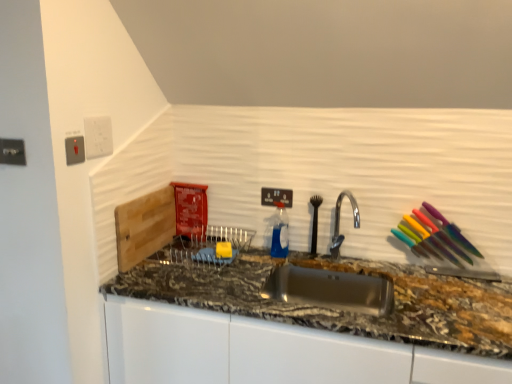
Question: Could you tell me if white plastic electric outlet at upper left, marked as the 2th electric outlet in a back-to-front arrangement, is turned towards black plastic electric outlet at upper center, positioned as the fourth electric outlet in left-to-right order?

Choices:
 (A) yes
 (B) no

Answer: (B)

Question: Is black plastic electric outlet at upper center, which appears as the fourth electric outlet when viewed from the front, inside white plastic electric outlet at upper left, the 3th electric outlet when ordered from front to back?

Choices:
 (A) no
 (B) yes

Answer: (A)

Question: From the image's perspective, is white plastic electric outlet at upper left, the 3th electric outlet when ordered from front to back, under black plastic electric outlet at upper center, arranged as the first electric outlet when viewed from the right?

Choices:
 (A) yes
 (B) no

Answer: (B)

Question: Does white plastic electric outlet at upper left, which is the 3th electric outlet in left-to-right order, have a lesser width compared to black plastic electric outlet at upper center, arranged as the first electric outlet when viewed from the right?

Choices:
 (A) yes
 (B) no

Answer: (A)

Question: Can you confirm if white plastic electric outlet at upper left, the 3th electric outlet when ordered from front to back, is positioned to the left of black plastic electric outlet at upper center, which appears as the first electric outlet when viewed from the back?

Choices:
 (A) yes
 (B) no

Answer: (A)

Question: Does white plastic electric outlet at upper left, marked as the 2th electric outlet in a back-to-front arrangement, have a lesser height compared to black plastic electric outlet at upper center, which appears as the fourth electric outlet when viewed from the front?

Choices:
 (A) yes
 (B) no

Answer: (B)

Question: Does granite at center have a larger size compared to metallic silver outlet at upper left, the first electric outlet positioned from the front?

Choices:
 (A) yes
 (B) no

Answer: (A)

Question: Does granite at center lie in front of metallic silver outlet at upper left, which is the 4th electric outlet from back to front?

Choices:
 (A) no
 (B) yes

Answer: (B)

Question: From a real-world perspective, is granite at center on top of metallic silver outlet at upper left, the first electric outlet positioned from the front?

Choices:
 (A) no
 (B) yes

Answer: (A)

Question: Is granite at center aimed at metallic silver outlet at upper left, which is the 4th electric outlet from back to front?

Choices:
 (A) no
 (B) yes

Answer: (A)

Question: Is the position of granite at center more distant than that of metallic silver outlet at upper left, the first electric outlet from the left?

Choices:
 (A) yes
 (B) no

Answer: (B)

Question: Is granite at center looking in the opposite direction of metallic silver outlet at upper left, which is the 4th electric outlet from back to front?

Choices:
 (A) no
 (B) yes

Answer: (A)

Question: From the image's perspective, is black plastic electric outlet at upper center, arranged as the first electric outlet when viewed from the right, below granite at center?

Choices:
 (A) no
 (B) yes

Answer: (A)